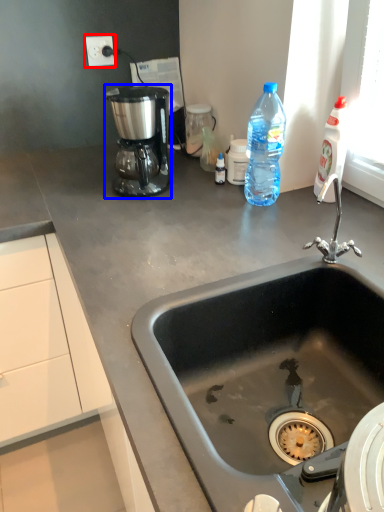
Question: Which of the following is the farthest to the observer, electric outlet (highlighted by a red box) or coffee maker (highlighted by a blue box)?

Choices:
 (A) electric outlet
 (B) coffee maker

Answer: (A)